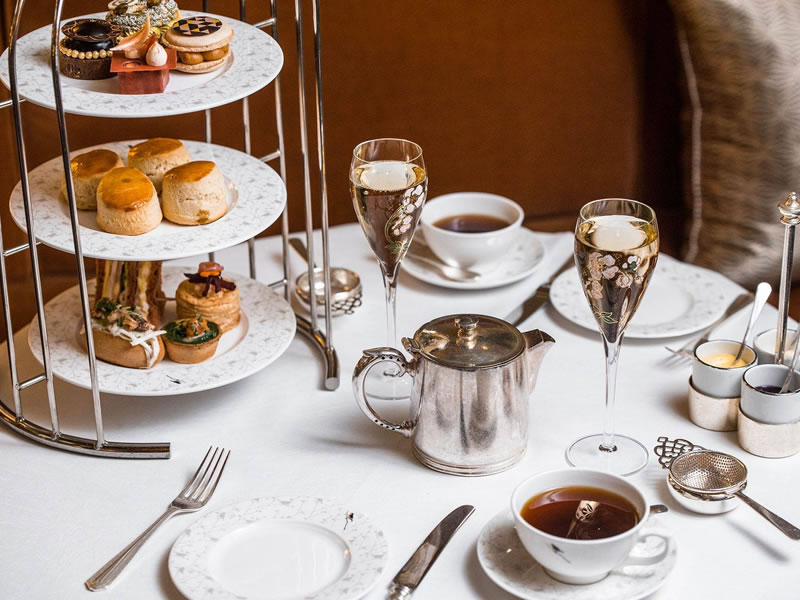
Where is `wall`? wall is located at coordinates (505, 86).